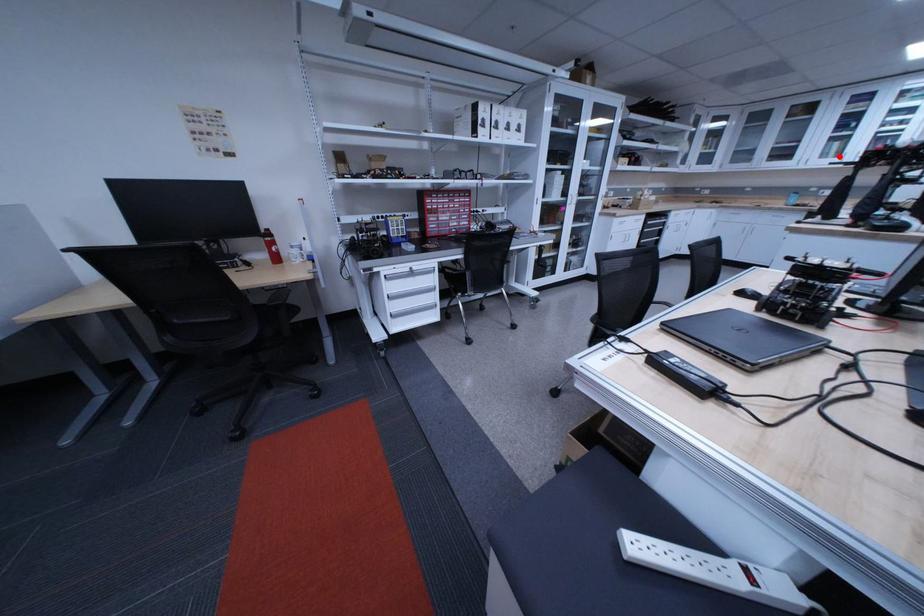
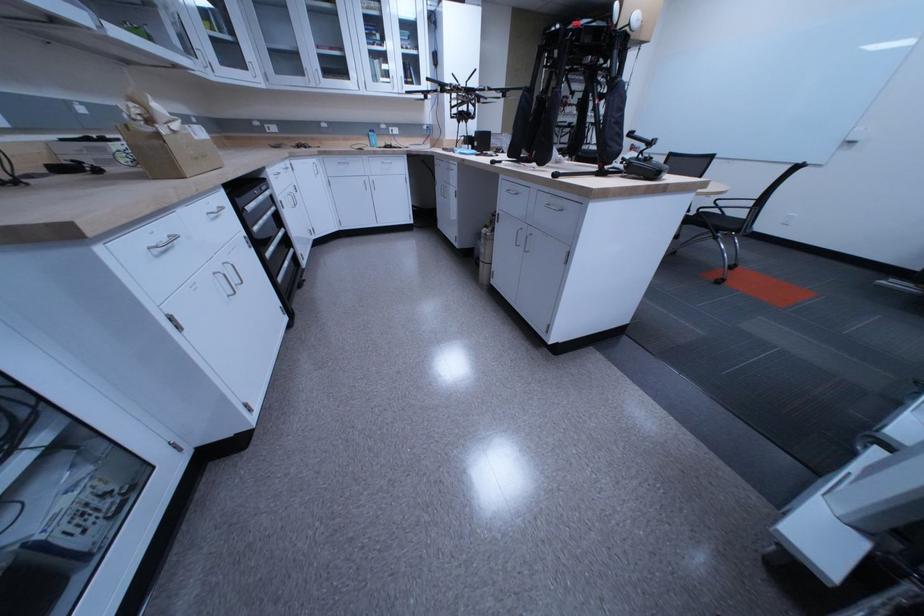
The point at the highlighted location is marked in the first image. Where is the corresponding point in the second image?

(390, 79)